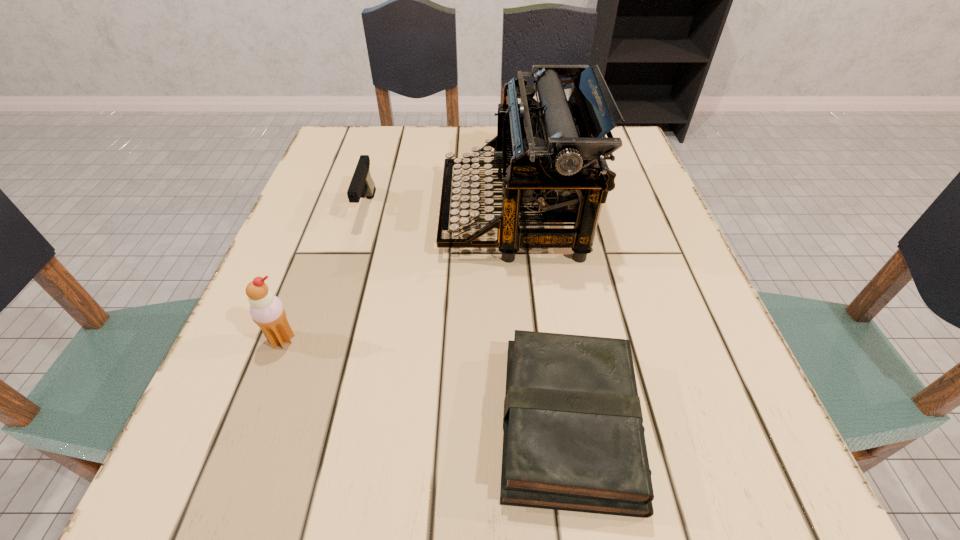
At what (x,y) coordinates should I click in order to perform the action: click on free region at the right edge. Please return your answer as a coordinate pair (x, y). Looking at the image, I should click on (641, 225).

Locate an element on the screen. The height and width of the screenshot is (540, 960). vacant space at the far left corner of the desktop is located at coordinates (360, 144).

In the image, there is a desktop. Where is `vacant space at the near left corner`? vacant space at the near left corner is located at coordinates (228, 465).

This screenshot has width=960, height=540. In order to click on vacant area that lies between the icecream and the second object from left to right in this screenshot , I will do `click(324, 274)`.

In order to click on free point between the second object from left to right and the shortest object in this screenshot , I will do `click(468, 316)`.

You are a GUI agent. You are given a task and a screenshot of the screen. Output one action in this format:
    pyautogui.click(x=<x>, y=<y>)
    Task: Click on the empty space between the book and the third object from right to left
    The height and width of the screenshot is (540, 960).
    Given the screenshot: What is the action you would take?
    pyautogui.click(x=468, y=316)

Locate an element on the screen. free space between the pistol and the book is located at coordinates (468, 316).

This screenshot has width=960, height=540. In order to click on free space between the shortest object and the second tallest object in this screenshot , I will do `click(425, 381)`.

Where is `free point between the book and the leftmost object`? free point between the book and the leftmost object is located at coordinates (425, 381).

Where is `free space between the book and the icecream`? This screenshot has width=960, height=540. free space between the book and the icecream is located at coordinates (425, 381).